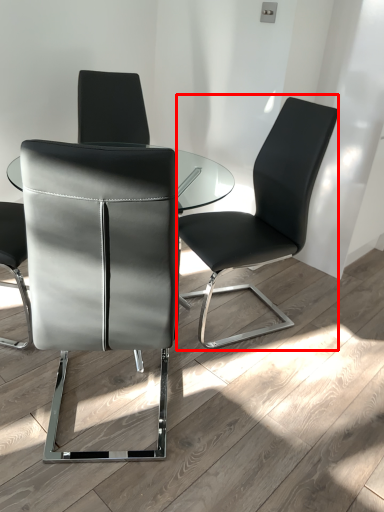
Question: From the image's perspective, where is chair (annotated by the red box) located in relation to chair in the image?

Choices:
 (A) above
 (B) below

Answer: (A)